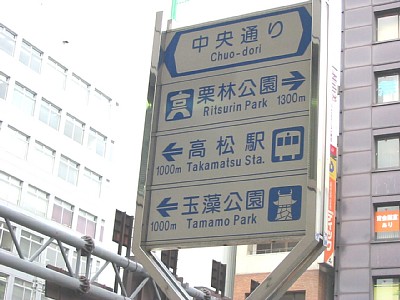
The width and height of the screenshot is (400, 300). I want to click on poster, so click(x=390, y=222).